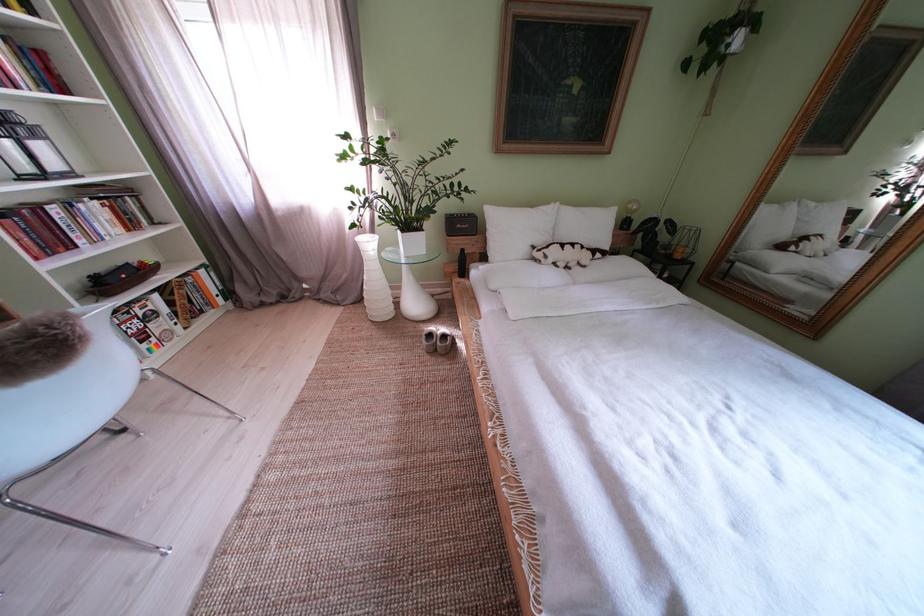
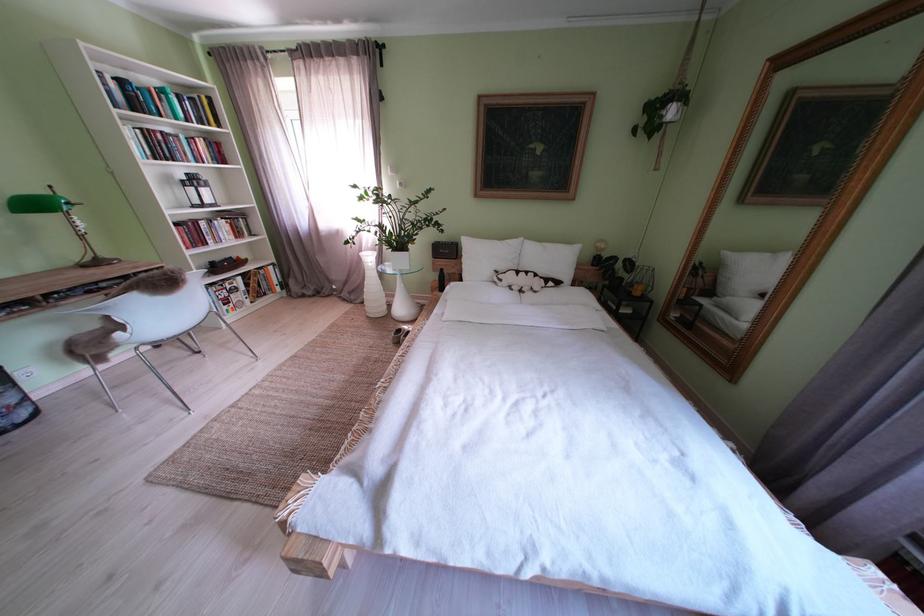
Find the pixel in the second image that matches point 520,237 in the first image.

(490, 262)